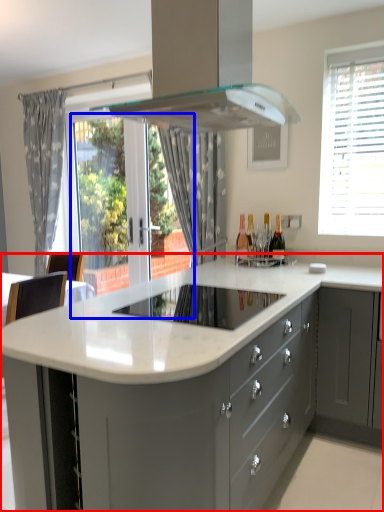
Question: Which object appears farthest to the camera in this image, countertop (highlighted by a red box) or glass door (highlighted by a blue box)?

Choices:
 (A) countertop
 (B) glass door

Answer: (B)